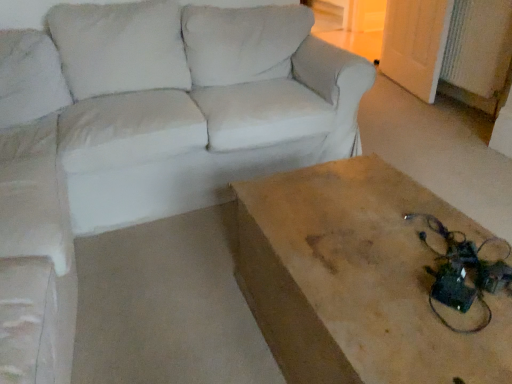
Question: In terms of width, does wooden table at center look wider or thinner when compared to white fabric couch at upper left?

Choices:
 (A) thin
 (B) wide

Answer: (A)

Question: Considering their positions, is wooden table at center located in front of or behind white fabric couch at upper left?

Choices:
 (A) behind
 (B) front

Answer: (B)

Question: In the image, is wooden table at center on the left side or the right side of white fabric couch at upper left?

Choices:
 (A) left
 (B) right

Answer: (B)

Question: In the image, is white fabric couch at upper left on the left side or the right side of wooden table at center?

Choices:
 (A) right
 (B) left

Answer: (B)

Question: Is white fabric couch at upper left taller or shorter than wooden table at center?

Choices:
 (A) short
 (B) tall

Answer: (A)

Question: Looking at the image, does white fabric couch at upper left seem bigger or smaller compared to wooden table at center?

Choices:
 (A) small
 (B) big

Answer: (B)

Question: From a real-world perspective, relative to wooden table at center, is white fabric couch at upper left vertically above or below?

Choices:
 (A) below
 (B) above

Answer: (A)